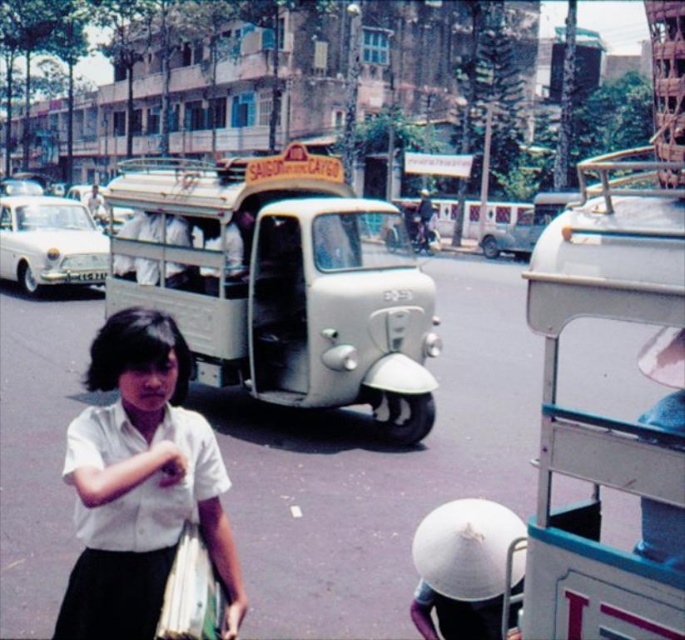
Question: Observing the image, what is the correct spatial positioning of white cotton blouse at center in reference to white glossy car at left?

Choices:
 (A) left
 (B) right

Answer: (B)

Question: Among these points, which one is nearest to the camera?

Choices:
 (A) (62, 209)
 (B) (92, 586)

Answer: (B)

Question: Does white cotton blouse at center have a larger size compared to white glossy car at left?

Choices:
 (A) yes
 (B) no

Answer: (A)

Question: Is white cotton blouse at center behind white glossy car at left?

Choices:
 (A) no
 (B) yes

Answer: (A)

Question: Which object is closer to the camera taking this photo?

Choices:
 (A) white cotton blouse at center
 (B) white glossy car at left

Answer: (A)

Question: Which point is closer to the camera?

Choices:
 (A) white glossy car at left
 (B) white cotton blouse at center

Answer: (B)